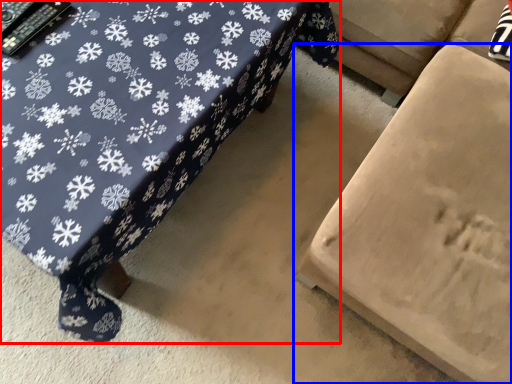
Question: Which object appears closest to the camera in this image, table (highlighted by a red box) or furniture (highlighted by a blue box)?

Choices:
 (A) table
 (B) furniture

Answer: (B)